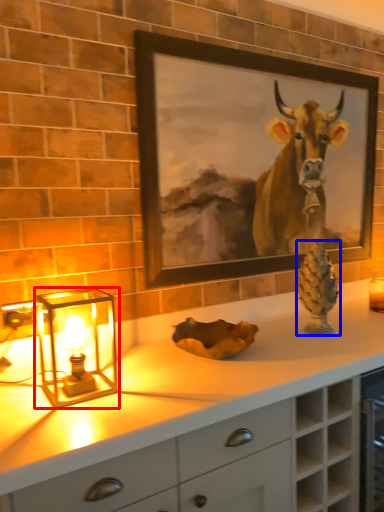
Question: Which object appears farthest to the camera in this image, table lamp (highlighted by a red box) or pine cone (highlighted by a blue box)?

Choices:
 (A) table lamp
 (B) pine cone

Answer: (B)